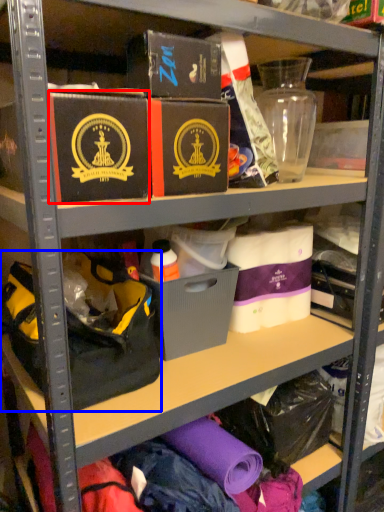
Question: Which of the following is the farthest to the observer, box (highlighted by a red box) or handbag (highlighted by a blue box)?

Choices:
 (A) box
 (B) handbag

Answer: (B)